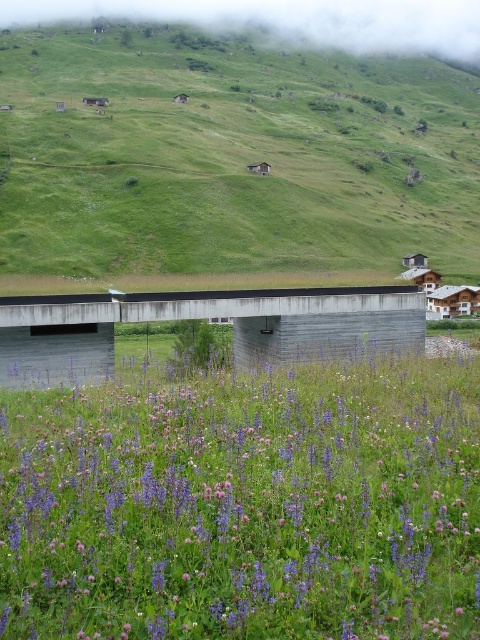
Is point (331, 108) positioned behind point (147, 310)?

Yes.

Measure the distance between green grassy hillside at upper center and camera.

They are 105.13 meters apart.

Find the location of a particular element. green grassy hillside at upper center is located at coordinates (230, 156).

Consider the image. Does purple matte flower at center appear over smooth concrete bridge at center?

Incorrect, purple matte flower at center is not positioned above smooth concrete bridge at center.

The height and width of the screenshot is (640, 480). I want to click on purple matte flower at center, so click(x=244, y=506).

Is point (354, 426) less distant than point (348, 314)?

Yes, it is.

Where is `purple matte flower at center`? This screenshot has width=480, height=640. purple matte flower at center is located at coordinates (244, 506).

What do you see at coordinates (244, 506) in the screenshot? I see `purple matte flower at center` at bounding box center [244, 506].

Is purple matte flower at center taller than green grassy hillside at upper center?

No, purple matte flower at center is not taller than green grassy hillside at upper center.

Is point (361, 545) positioned in front of point (358, 92)?

Yes, point (361, 545) is in front of point (358, 92).

This screenshot has height=640, width=480. Find the location of `purple matte flower at center`. purple matte flower at center is located at coordinates (244, 506).